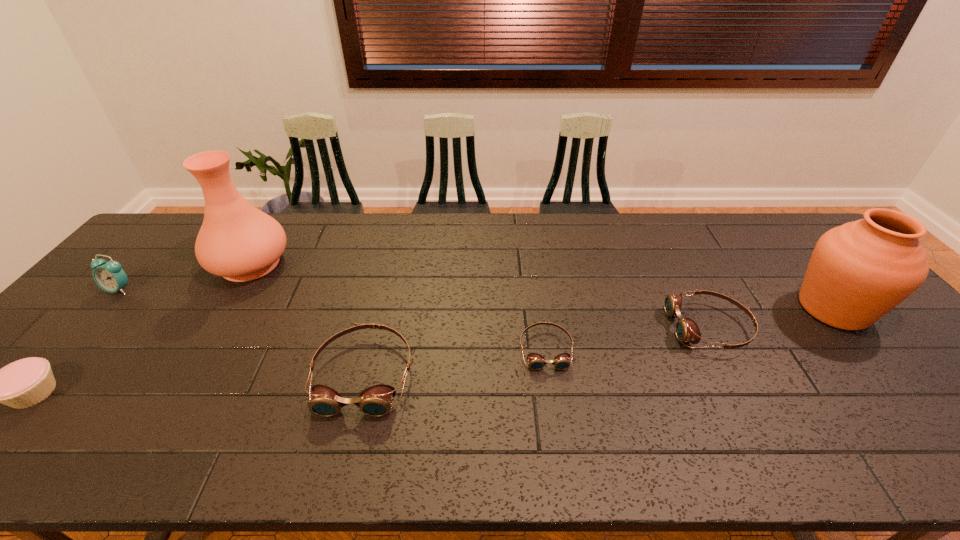
Where is `vacant space that satisfies the following two spatial constraints: 1. through the lenses of the second tallest goggles; 2. through the lenses of the fourth object from left to right`? vacant space that satisfies the following two spatial constraints: 1. through the lenses of the second tallest goggles; 2. through the lenses of the fourth object from left to right is located at coordinates (734, 374).